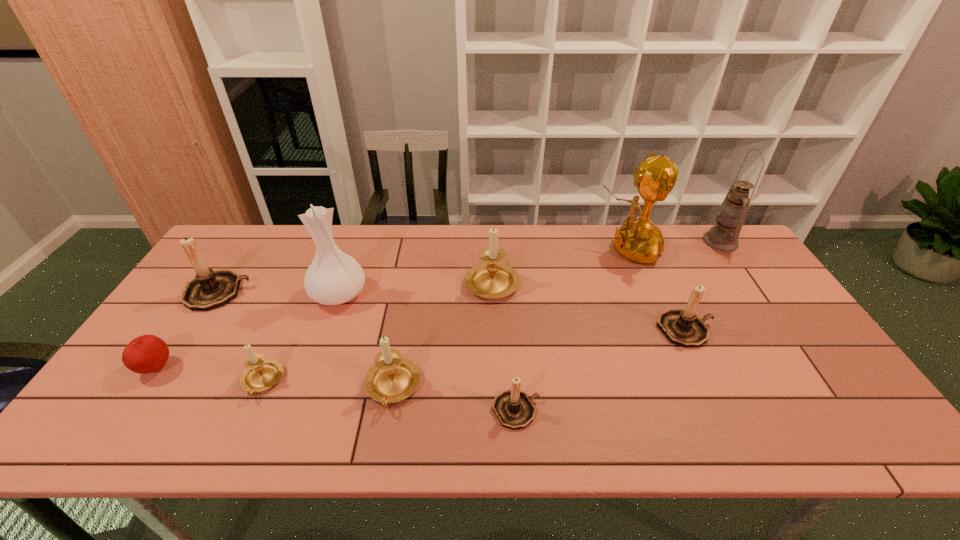
This screenshot has height=540, width=960. What are the coordinates of `gold award` in the screenshot? It's located at (638, 240).

The image size is (960, 540). In order to click on gray oil lamp in this screenshot , I will do `click(730, 218)`.

Image resolution: width=960 pixels, height=540 pixels. In order to click on oil lamp in this screenshot , I will do `click(730, 218)`.

Identify the location of the third tallest object. (334, 277).

You are a GUI agent. You are given a task and a screenshot of the screen. Output one action in this format:
    pyautogui.click(x=<x>, y=<y>)
    Task: Click on the white vase
    The width and height of the screenshot is (960, 540).
    Given the screenshot: What is the action you would take?
    pyautogui.click(x=334, y=277)

The height and width of the screenshot is (540, 960). In order to click on the biggest beige candle holder in this screenshot , I will do `click(492, 279)`.

At what (x,y) coordinates should I click in order to perform the action: click on the farthest beige candle holder. Please return your answer as a coordinate pair (x, y). The width and height of the screenshot is (960, 540). Looking at the image, I should click on (492, 279).

Locate an element on the screen. the biggest brown candle holder is located at coordinates (210, 289).

At what (x,y) coordinates should I click in order to perform the action: click on the leftmost candle holder. Please return your answer as a coordinate pair (x, y). Image resolution: width=960 pixels, height=540 pixels. Looking at the image, I should click on (210, 289).

The width and height of the screenshot is (960, 540). Identify the location of the rightmost candle holder. (682, 327).